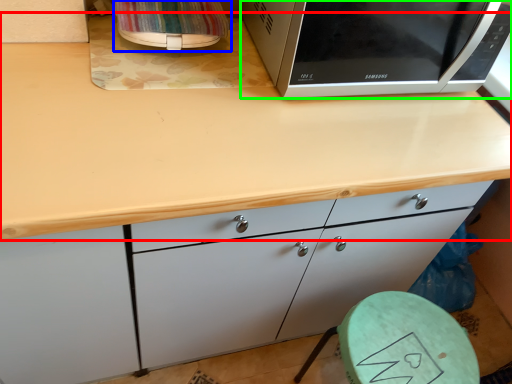
Question: Which is nearer to the countertop (highlighted by a red box)? appliance (highlighted by a blue box) or microwave oven (highlighted by a green box).

Choices:
 (A) appliance
 (B) microwave oven

Answer: (B)